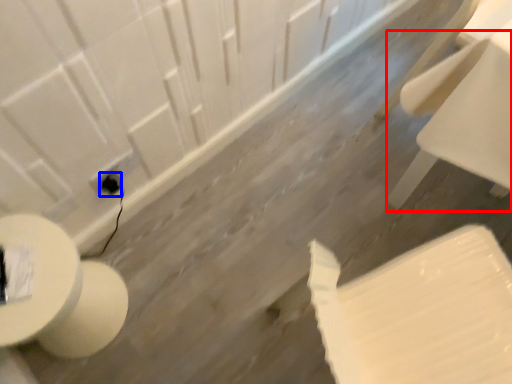
Question: Which object is further to the camera taking this photo, chair (highlighted by a red box) or electric outlet (highlighted by a blue box)?

Choices:
 (A) chair
 (B) electric outlet

Answer: (B)